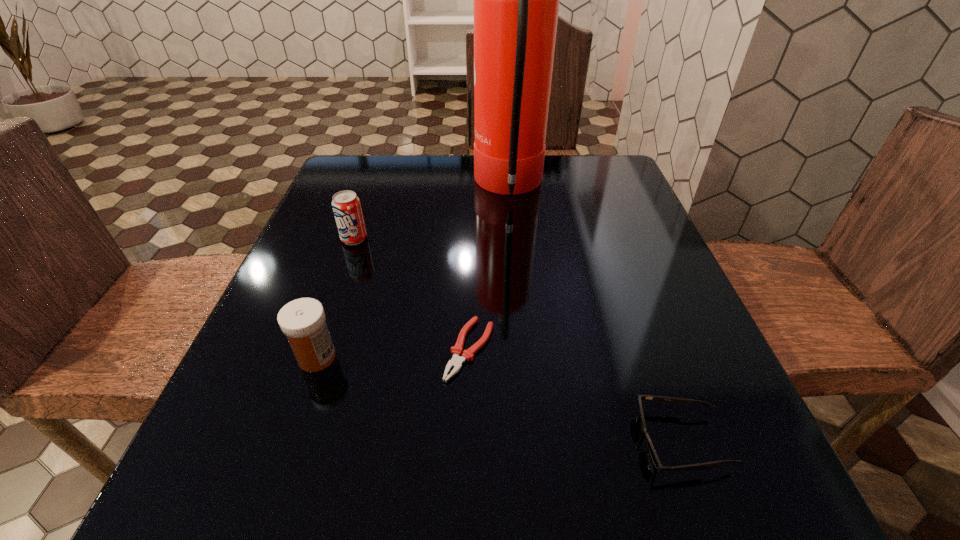
You are a GUI agent. You are given a task and a screenshot of the screen. Output one action in this format:
    pyautogui.click(x=<x>, y=<y>)
    Task: Click on the farthest object
    This screenshot has height=540, width=960.
    Given the screenshot: What is the action you would take?
    pyautogui.click(x=516, y=0)

Locate an element on the screen. the tallest object is located at coordinates (516, 0).

Image resolution: width=960 pixels, height=540 pixels. I want to click on soda can, so click(x=346, y=205).

Locate an element on the screen. Image resolution: width=960 pixels, height=540 pixels. medicine is located at coordinates (302, 320).

The height and width of the screenshot is (540, 960). Find the location of `sunglasses`. sunglasses is located at coordinates (678, 401).

What are the coordinates of `the rightmost object` in the screenshot? It's located at (678, 401).

The image size is (960, 540). I want to click on the shortest object, so click(456, 362).

Identify the location of vacant space located 0.110m towards the nozzle of the farthest object. The height and width of the screenshot is (540, 960). (429, 187).

This screenshot has width=960, height=540. Find the location of `free spot located 0.200m towards the nozzle of the farthest object`. free spot located 0.200m towards the nozzle of the farthest object is located at coordinates (393, 187).

Where is `vacant space located towards the nozzle of the farthest object`? vacant space located towards the nozzle of the farthest object is located at coordinates (389, 187).